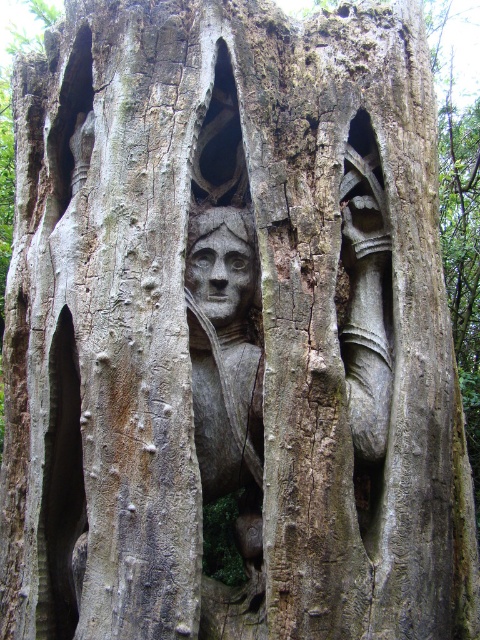
Question: Among these points, which one is farthest from the camera?

Choices:
 (A) (217, 243)
 (B) (218, 408)
 (C) (215, 138)

Answer: (C)

Question: Is smooth wood carving at center positioned before matte stone face at center?

Choices:
 (A) yes
 (B) no

Answer: (A)

Question: Which point is closer to the camera?

Choices:
 (A) carved wood face at center
 (B) smooth wood carving at center
 (C) matte stone face at center

Answer: (B)

Question: Can you confirm if carved wood face at center is smaller than matte stone face at center?

Choices:
 (A) no
 (B) yes

Answer: (A)

Question: Which of the following is the closest to the observer?

Choices:
 (A) (228, 128)
 (B) (216, 476)
 (C) (204, 248)

Answer: (B)

Question: Can you confirm if carved wood face at center is smaller than matte stone face at center?

Choices:
 (A) no
 (B) yes

Answer: (A)